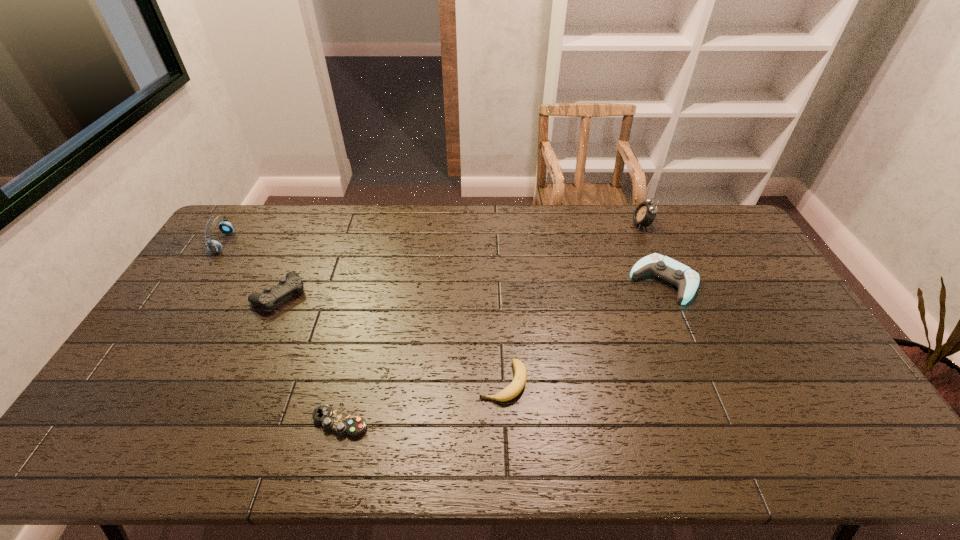
At what (x,y) coordinates should I click in order to perform the action: click on alarm clock. Please return your answer as a coordinate pair (x, y). Looking at the image, I should click on (645, 213).

Where is `headset`? Image resolution: width=960 pixels, height=540 pixels. headset is located at coordinates (214, 246).

You are a GUI agent. You are given a task and a screenshot of the screen. Output one action in this format:
    pyautogui.click(x=<x>, y=<y>)
    Task: Click on the leftmost control
    The height and width of the screenshot is (540, 960).
    Given the screenshot: What is the action you would take?
    pyautogui.click(x=292, y=283)

This screenshot has width=960, height=540. Identify the location of the rightmost control. (687, 280).

Find the location of `the fourth object from left to right`. the fourth object from left to right is located at coordinates (520, 377).

The height and width of the screenshot is (540, 960). Find the location of `the second nearest object`. the second nearest object is located at coordinates (520, 377).

You are a GUI agent. You are given a task and a screenshot of the screen. Output one action in this format:
    pyautogui.click(x=<x>, y=<y>)
    Task: Click on the second control from left to right
    
    Given the screenshot: What is the action you would take?
    pyautogui.click(x=330, y=419)

Where is `the shortest control`? This screenshot has height=540, width=960. the shortest control is located at coordinates (330, 419).

Image resolution: width=960 pixels, height=540 pixels. In order to click on vacant space located 0.140m on the face of the alarm clock in this screenshot , I will do `click(595, 225)`.

The width and height of the screenshot is (960, 540). Find the location of `free space located on the face of the alarm clock`. free space located on the face of the alarm clock is located at coordinates (553, 225).